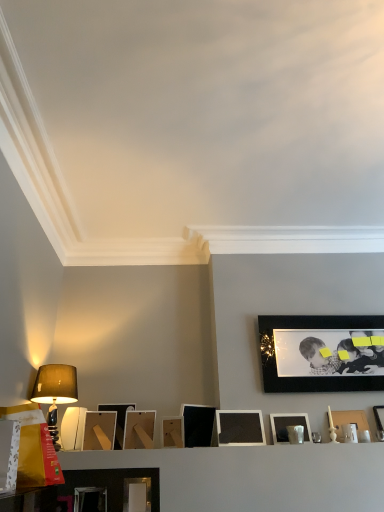
Question: Which direction should I rotate to face white matte picture frame at center, the fourth picture frame positioned from the left, — up or down?

Choices:
 (A) down
 (B) up

Answer: (A)

Question: Considering the relative sizes of matte black picture frame at center, which is counted as the 8th picture frame, starting from the left, and white matte picture frame at center, the tenth picture frame in the right-to-left sequence, in the image provided, is matte black picture frame at center, which is counted as the 8th picture frame, starting from the left, wider than white matte picture frame at center, the tenth picture frame in the right-to-left sequence,?

Choices:
 (A) no
 (B) yes

Answer: (A)

Question: From a real-world perspective, is matte black picture frame at center, which is counted as the 8th picture frame, starting from the left, positioned under white matte picture frame at center, the tenth picture frame in the right-to-left sequence, based on gravity?

Choices:
 (A) yes
 (B) no

Answer: (A)

Question: Is matte black picture frame at center, which is counted as the 8th picture frame, starting from the left, at the left side of white matte picture frame at center, the tenth picture frame in the right-to-left sequence?

Choices:
 (A) no
 (B) yes

Answer: (A)

Question: Is the depth of matte black picture frame at center, the 6th picture frame positioned from the right, less than that of white matte picture frame at center, the fourth picture frame positioned from the left?

Choices:
 (A) yes
 (B) no

Answer: (A)

Question: From a real-world perspective, is matte black picture frame at center, the 6th picture frame positioned from the right, located higher than white matte picture frame at center, the fourth picture frame positioned from the left?

Choices:
 (A) yes
 (B) no

Answer: (B)

Question: Considering the relative positions of matte black picture frame at center, the 6th picture frame positioned from the right, and white matte picture frame at center, the tenth picture frame in the right-to-left sequence, in the image provided, is matte black picture frame at center, the 6th picture frame positioned from the right, to the right of white matte picture frame at center, the tenth picture frame in the right-to-left sequence, from the viewer's perspective?

Choices:
 (A) yes
 (B) no

Answer: (A)

Question: Is there a large distance between matte black picture frame at right, the first picture frame from the right, and matte brown lampshade at left?

Choices:
 (A) yes
 (B) no

Answer: (A)

Question: Can you confirm if matte black picture frame at right, which ranks as the 13th picture frame in left-to-right order, is smaller than matte brown lampshade at left?

Choices:
 (A) no
 (B) yes

Answer: (B)

Question: Does matte black picture frame at right, which ranks as the 13th picture frame in left-to-right order, have a greater width compared to matte brown lampshade at left?

Choices:
 (A) no
 (B) yes

Answer: (A)

Question: Is matte black picture frame at right, the first picture frame from the right, thinner than matte brown lampshade at left?

Choices:
 (A) yes
 (B) no

Answer: (A)

Question: From a real-world perspective, is matte black picture frame at right, which ranks as the 13th picture frame in left-to-right order, on matte brown lampshade at left?

Choices:
 (A) yes
 (B) no

Answer: (B)

Question: Does matte black picture frame at right, which ranks as the 13th picture frame in left-to-right order, turn towards matte brown lampshade at left?

Choices:
 (A) no
 (B) yes

Answer: (A)

Question: Is matte brown picture frame at lower center, which appears as the 11th picture frame when viewed from the right, taller than matte wooden picture frame at center, which is the 9th picture frame from right to left?

Choices:
 (A) no
 (B) yes

Answer: (A)